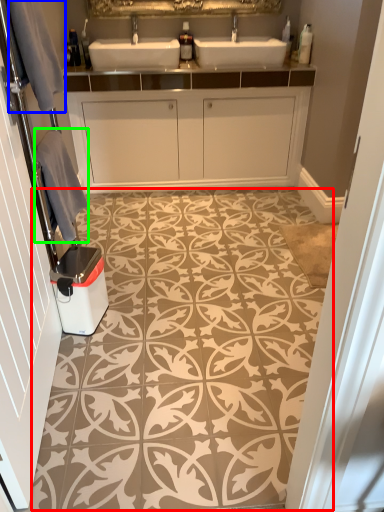
Question: Considering the real-world distances, which object is closest to design (highlighted by a red box)? gray (highlighted by a blue box) or material (highlighted by a green box).

Choices:
 (A) gray
 (B) material

Answer: (B)